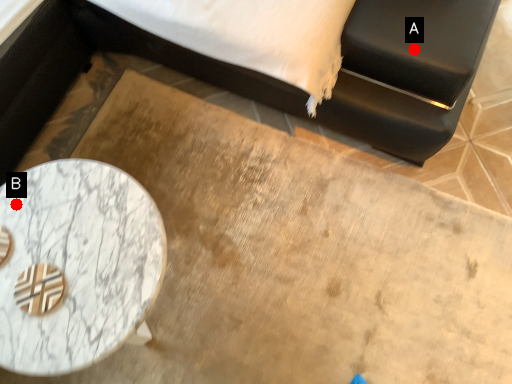
Question: Two points are circled on the image, labeled by A and B beside each circle. Which point is farther from the camera taking this photo?

Choices:
 (A) A is further
 (B) B is further

Answer: (A)